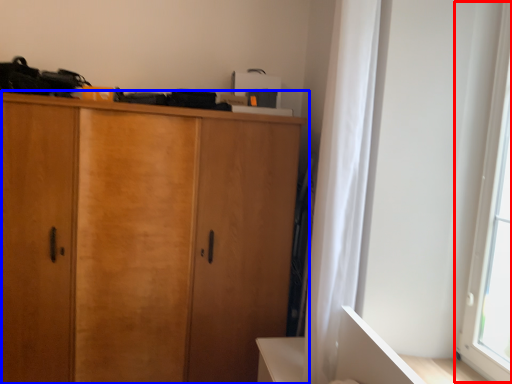
Question: Which point is further to the camera, window screen (highlighted by a red box) or cupboard (highlighted by a blue box)?

Choices:
 (A) window screen
 (B) cupboard

Answer: (B)